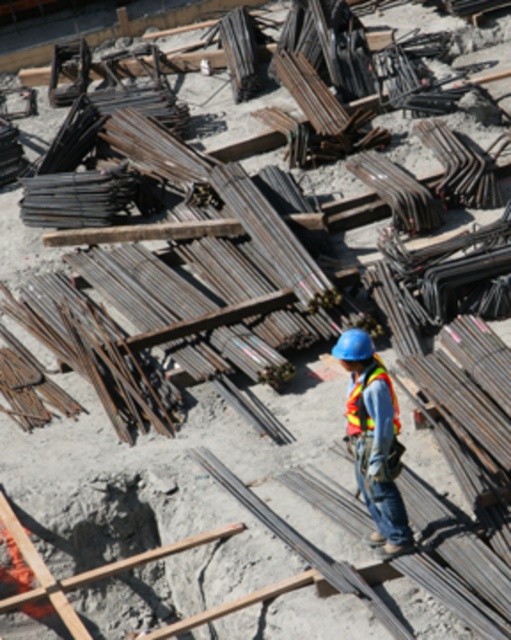
Between point (367, 369) and point (364, 340), which one is positioned in front?

Point (364, 340)

Who is higher up, reflective fabric safety vest at center or blue hard hat at center?

Positioned higher is blue hard hat at center.

Who is more forward, (x=350, y=392) or (x=360, y=346)?

Positioned in front is point (x=360, y=346).

This screenshot has width=511, height=640. I want to click on reflective fabric safety vest at center, so click(363, 403).

The image size is (511, 640). In order to click on reflective orange safety vest at center in this screenshot , I will do point(375,440).

Between point (362, 419) and point (356, 353), which one is positioned in front?

Point (356, 353) is more forward.

Between point (379, 490) and point (355, 353), which one is positioned in front?

Positioned in front is point (355, 353).

Where is `reflective orange safety vest at center`? The image size is (511, 640). reflective orange safety vest at center is located at coordinates pyautogui.click(x=375, y=440).

Between reflective orange safety vest at center and reflective fabric safety vest at center, which one appears on the right side from the viewer's perspective?

From the viewer's perspective, reflective orange safety vest at center appears more on the right side.

What do you see at coordinates (375, 440) in the screenshot? I see `reflective orange safety vest at center` at bounding box center [375, 440].

Image resolution: width=511 pixels, height=640 pixels. What do you see at coordinates (375, 440) in the screenshot?
I see `reflective orange safety vest at center` at bounding box center [375, 440].

The image size is (511, 640). Find the location of `reflective orange safety vest at center`. reflective orange safety vest at center is located at coordinates (375, 440).